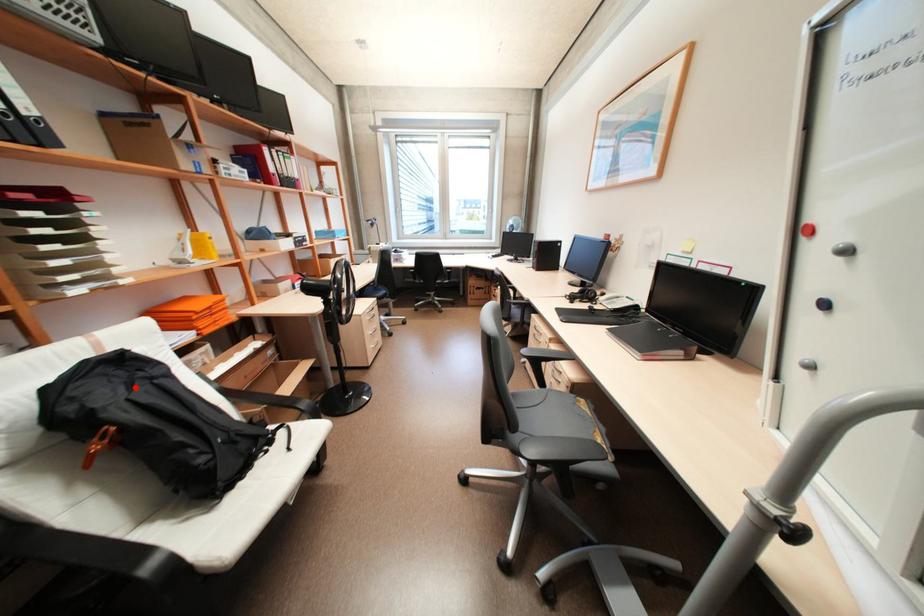
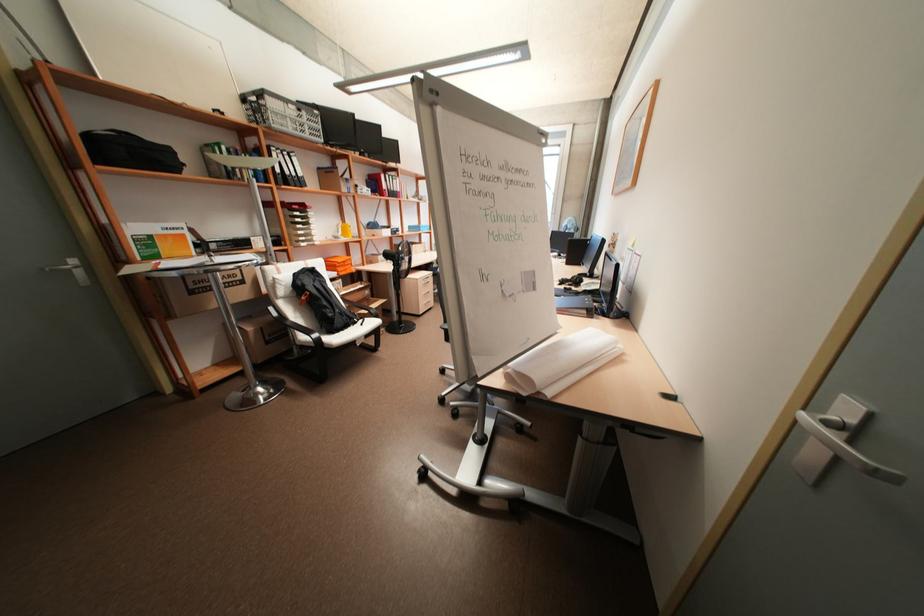
Question: I am providing you with two images of the same scene from different viewpoints. In image1, a red point is highlighted. Considering the same 3D point in image2, which of the following is correct?

Choices:
 (A) It is closer
 (B) It is farther

Answer: (A)